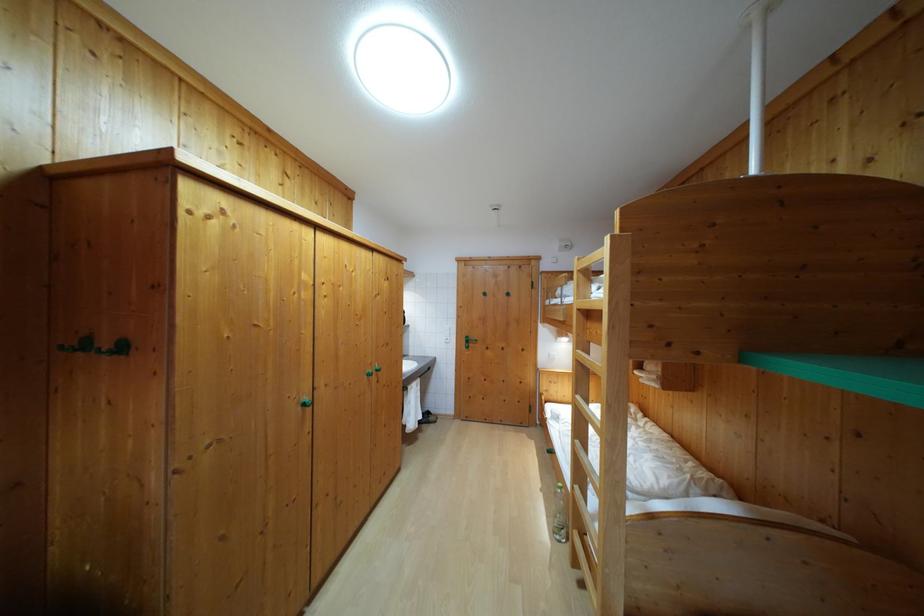
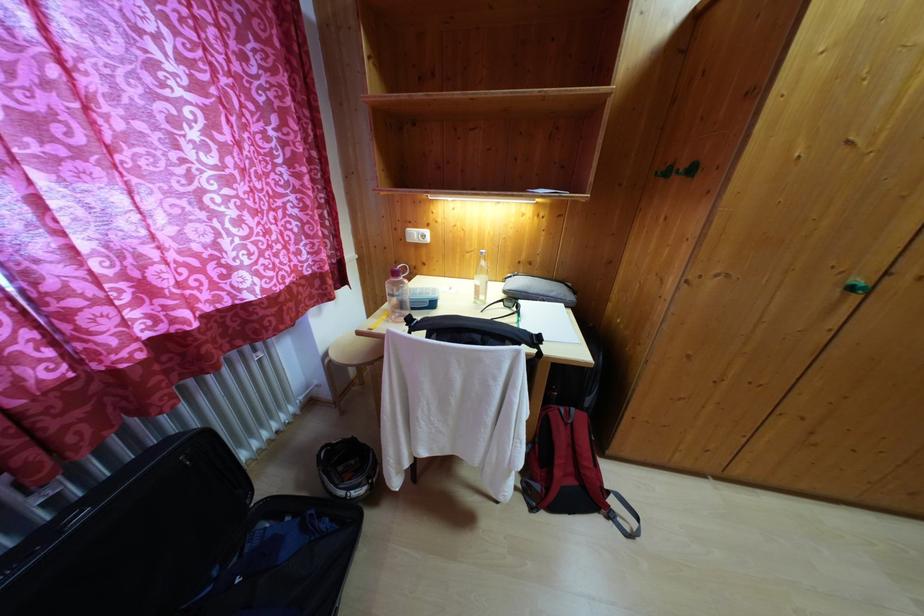
In the second image, find the point that corresponds to the point at 310,407 in the first image.

(866, 290)